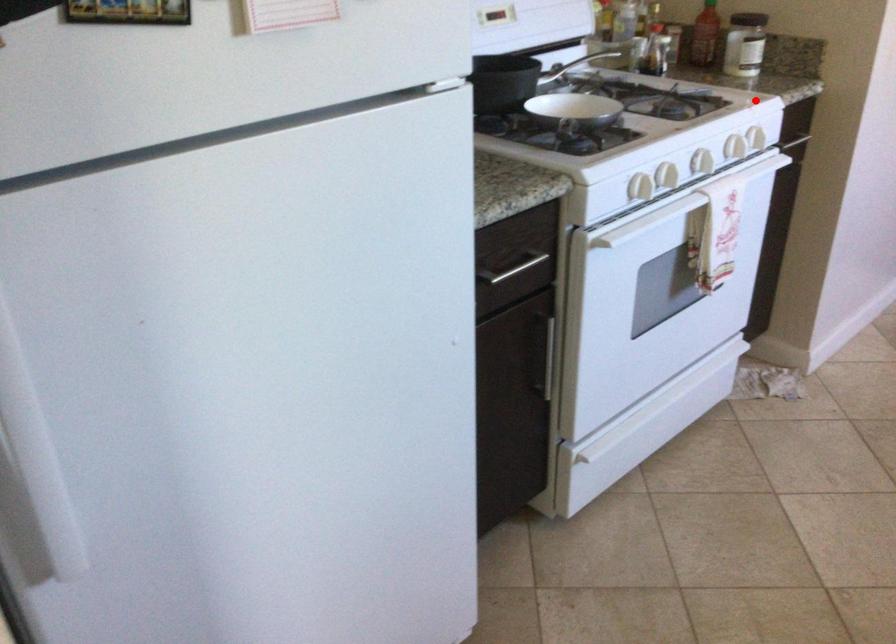
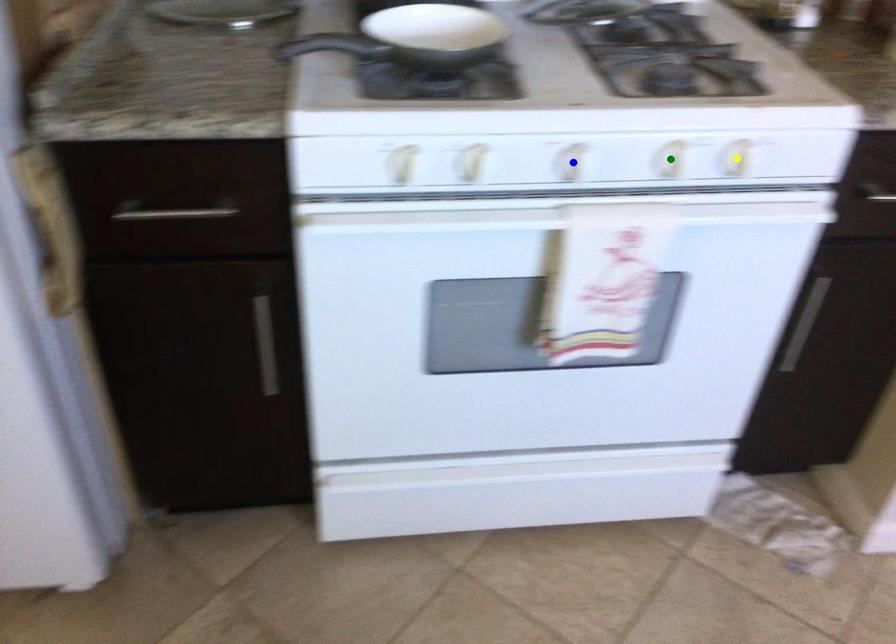
Question: I am providing you with two images of the same scene from different viewpoints. A red point is marked on the first image. You are given multiple points on the second image. Which mark in image 2 goes with the point in image 1?

Choices:
 (A) green point
 (B) yellow point
 (C) blue point

Answer: (B)